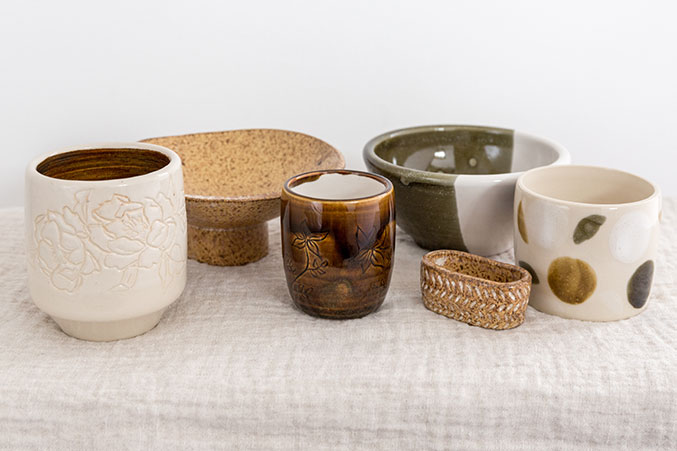
Where is `green and white bowl`? The height and width of the screenshot is (451, 677). green and white bowl is located at coordinates (451, 211).